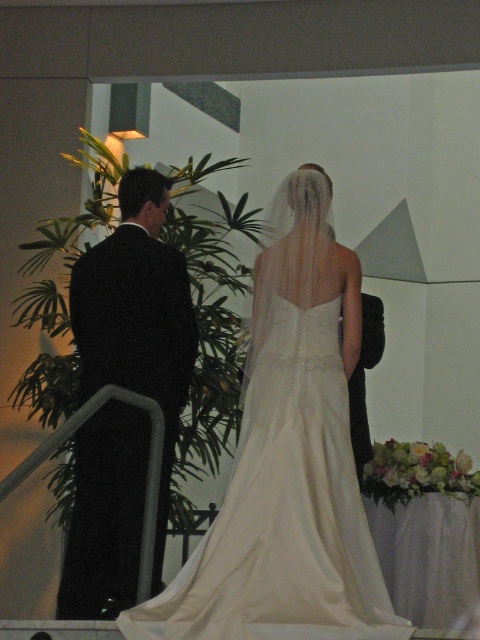
You are a photographer at the wedding ceremony. You need to position yourself to capture a photo of both the ivory satin dress at center and the black suit at left in the same frame. Considering their sizes, which one should you focus on to ensure both are fully visible?

The ivory satin dress at center has a larger width than the black suit at left, so you should focus on the ivory satin dress at center to ensure both are fully visible in the frame.

You are a photographer at a wedding. You need to position yourself to capture a photo of the ivory satin dress at center and the black suit at left. Based on their sizes, which one should you focus on first to ensure both are in frame?

The ivory satin dress at center is larger in size than the black suit at left, so you should focus on the ivory satin dress at center first to ensure it fits within the frame before adjusting for the smaller black suit at left.